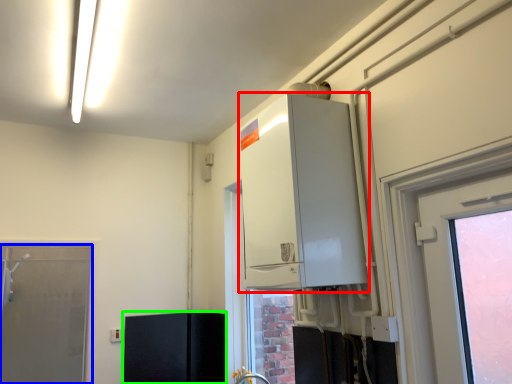
Question: Which object is the farthest from appliance (highlighted by a red box)? Choose among these: door (highlighted by a blue box) or cabinetry (highlighted by a green box).

Choices:
 (A) door
 (B) cabinetry

Answer: (A)